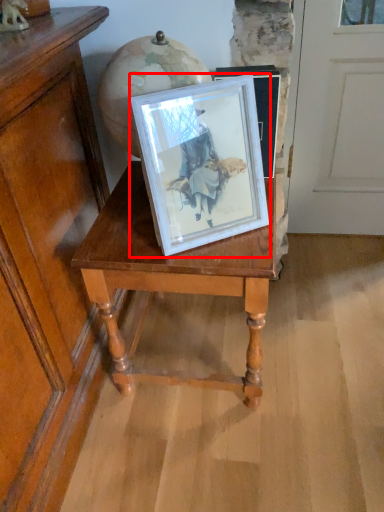
Question: From the image's perspective, what is the correct spatial relationship of picture frame (annotated by the red box) in relation to table?

Choices:
 (A) above
 (B) below

Answer: (A)